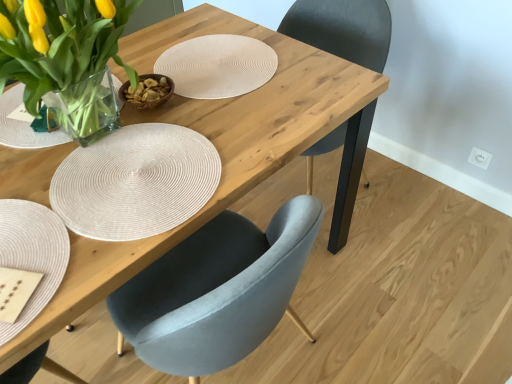
Find the location of a particular element. vacant area that is situated to the right of beige woven placemat at lower left is located at coordinates (132, 210).